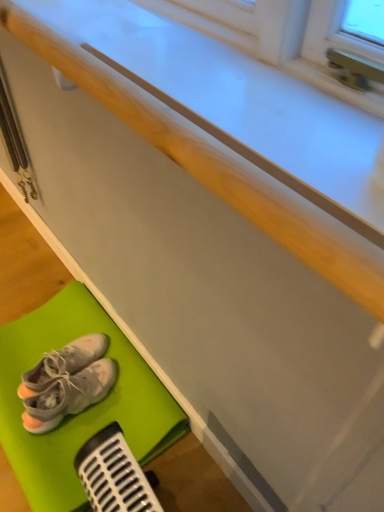
Question: Does white fabric sneakers at lower left, placed as the 2th footwear when sorted from bottom to top, have a smaller size compared to matte white counter top at center?

Choices:
 (A) yes
 (B) no

Answer: (A)

Question: From the image's perspective, is white fabric sneakers at lower left, which appears as the 1th footwear when viewed from the top, over matte white counter top at center?

Choices:
 (A) yes
 (B) no

Answer: (B)

Question: Is matte white counter top at center located within white fabric sneakers at lower left, placed as the 2th footwear when sorted from bottom to top?

Choices:
 (A) yes
 (B) no

Answer: (B)

Question: Would you say white fabric sneakers at lower left, which appears as the 1th footwear when viewed from the top, is outside matte white counter top at center?

Choices:
 (A) no
 (B) yes

Answer: (B)

Question: Can you confirm if white fabric sneakers at lower left, which appears as the 1th footwear when viewed from the top, is positioned to the right of matte white counter top at center?

Choices:
 (A) no
 (B) yes

Answer: (A)

Question: Does white fabric sneakers at lower left, which appears as the 1th footwear when viewed from the top, come behind matte white counter top at center?

Choices:
 (A) yes
 (B) no

Answer: (A)

Question: Can you confirm if white fabric sneakers at lower left, placed as the 2th footwear when sorted from bottom to top, is taller than green rubber bath mat at lower left?

Choices:
 (A) no
 (B) yes

Answer: (B)

Question: Is the position of white fabric sneakers at lower left, placed as the 2th footwear when sorted from bottom to top, more distant than that of green rubber bath mat at lower left?

Choices:
 (A) no
 (B) yes

Answer: (B)

Question: Is white fabric sneakers at lower left, which appears as the 1th footwear when viewed from the top, not near green rubber bath mat at lower left?

Choices:
 (A) no
 (B) yes

Answer: (A)

Question: Is white fabric sneakers at lower left, placed as the 2th footwear when sorted from bottom to top, positioned before green rubber bath mat at lower left?

Choices:
 (A) yes
 (B) no

Answer: (B)

Question: From the image's perspective, would you say white fabric sneakers at lower left, placed as the 2th footwear when sorted from bottom to top, is positioned over green rubber bath mat at lower left?

Choices:
 (A) no
 (B) yes

Answer: (B)

Question: From the image's perspective, is white fabric sneakers at lower left, placed as the 2th footwear when sorted from bottom to top, under green rubber bath mat at lower left?

Choices:
 (A) yes
 (B) no

Answer: (B)

Question: Does green rubber bath mat at lower left have a smaller size compared to white fabric sneakers at lower left, which appears as the 1th footwear when viewed from the top?

Choices:
 (A) no
 (B) yes

Answer: (A)